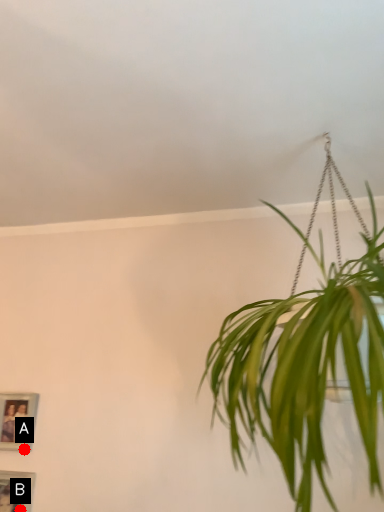
Question: Two points are circled on the image, labeled by A and B beside each circle. Among these points, which one is nearest to the camera?

Choices:
 (A) A is closer
 (B) B is closer

Answer: (B)